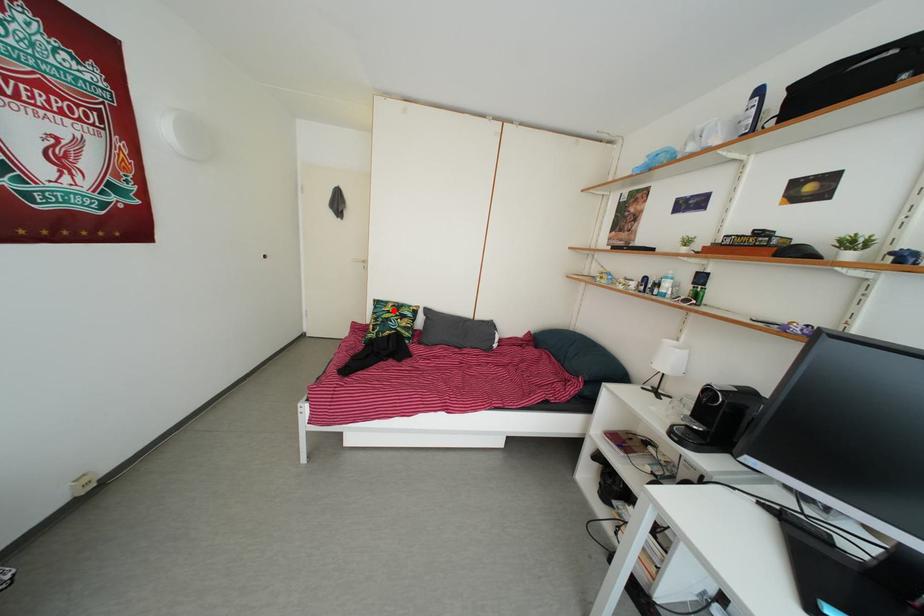
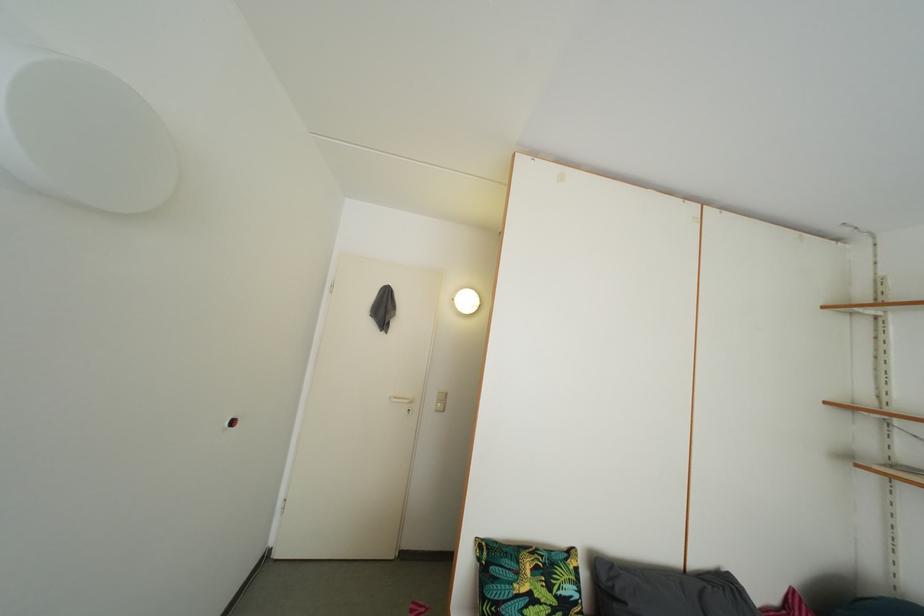
Find the pixel in the second image that matches the highlighted location in the first image.

(521, 562)